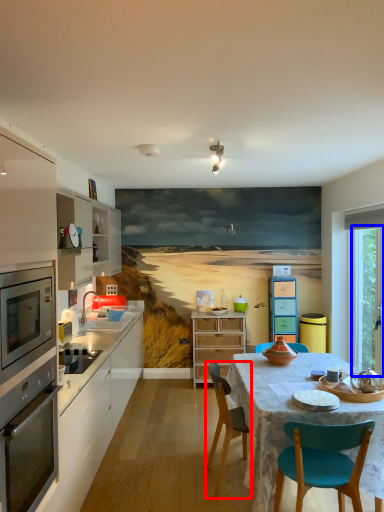
Question: Which of the following is the farthest to the observer, chair (highlighted by a red box) or window screen (highlighted by a blue box)?

Choices:
 (A) chair
 (B) window screen

Answer: (B)